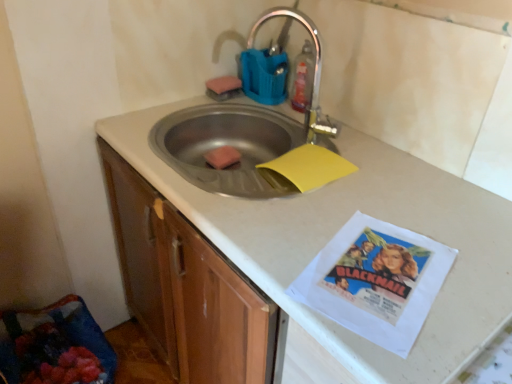
Identify the location of vacant space positioned to the left of translucent plastic bottle at upper center. This screenshot has width=512, height=384. (264, 105).